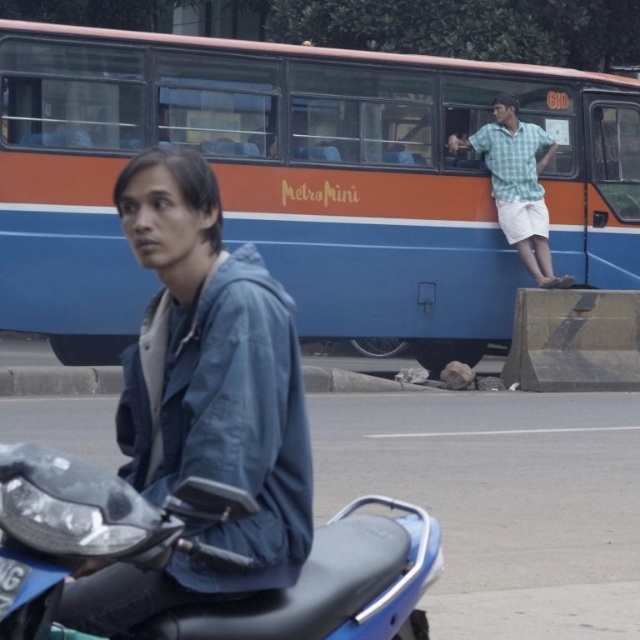
Between blue matte motorcycle at lower left and light green checkered shirt at upper right, which one is positioned lower?

blue matte motorcycle at lower left is lower down.

Can you confirm if blue matte motorcycle at lower left is wider than light green checkered shirt at upper right?

In fact, blue matte motorcycle at lower left might be narrower than light green checkered shirt at upper right.

Image resolution: width=640 pixels, height=640 pixels. What do you see at coordinates (90, 531) in the screenshot?
I see `blue matte motorcycle at lower left` at bounding box center [90, 531].

Where is `blue matte motorcycle at lower left`? blue matte motorcycle at lower left is located at coordinates (90, 531).

Is blue matte bus at upper center bigger than blue matte jacket at center?

Actually, blue matte bus at upper center might be smaller than blue matte jacket at center.

Identify the location of blue matte bus at upper center. (300, 180).

Is blue matte bus at upper center taller than blue matte motorcycle at lower left?

No, blue matte bus at upper center is not taller than blue matte motorcycle at lower left.

You are a GUI agent. You are given a task and a screenshot of the screen. Output one action in this format:
    pyautogui.click(x=<x>, y=<y>)
    Task: Click on the blue matte bus at upper center
    This screenshot has width=640, height=640.
    Given the screenshot: What is the action you would take?
    pyautogui.click(x=300, y=180)

The width and height of the screenshot is (640, 640). In order to click on blue matte bus at upper center in this screenshot , I will do `click(300, 180)`.